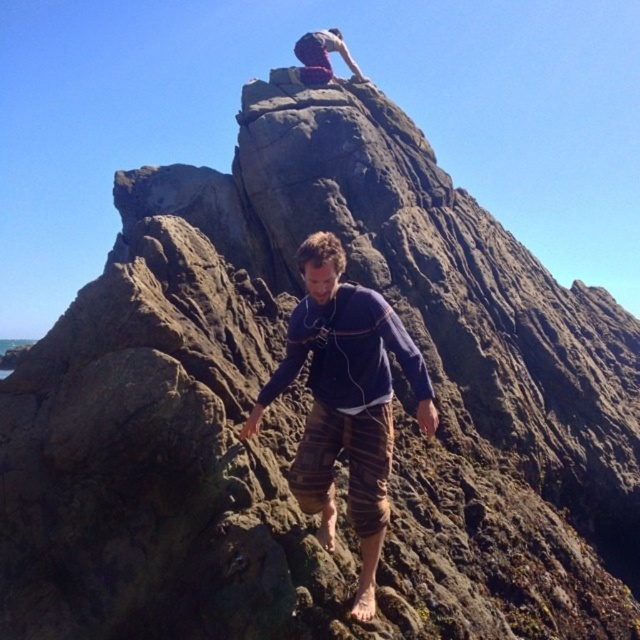
Question: Is striped cotton shorts at center thinner than red fabric pants at upper center?

Choices:
 (A) yes
 (B) no

Answer: (B)

Question: Among these points, which one is farthest from the camera?

Choices:
 (A) (353, 442)
 (B) (344, 44)

Answer: (B)

Question: Which point appears farthest from the camera in this image?

Choices:
 (A) (353, 60)
 (B) (317, 310)

Answer: (A)

Question: Is striped cotton shorts at center smaller than red fabric pants at upper center?

Choices:
 (A) no
 (B) yes

Answer: (A)

Question: Which point is farther to the camera?

Choices:
 (A) red fabric pants at upper center
 (B) striped cotton shorts at center

Answer: (A)

Question: Is striped cotton shorts at center below red fabric pants at upper center?

Choices:
 (A) yes
 (B) no

Answer: (A)